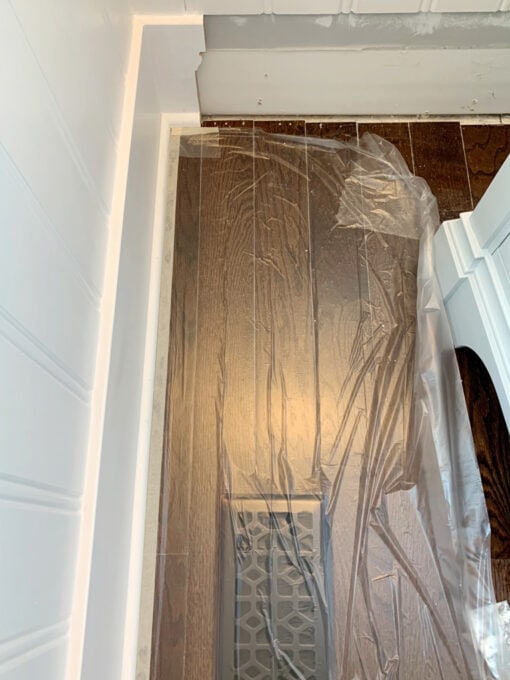
Where is `heating vent`? heating vent is located at coordinates (x=275, y=615).